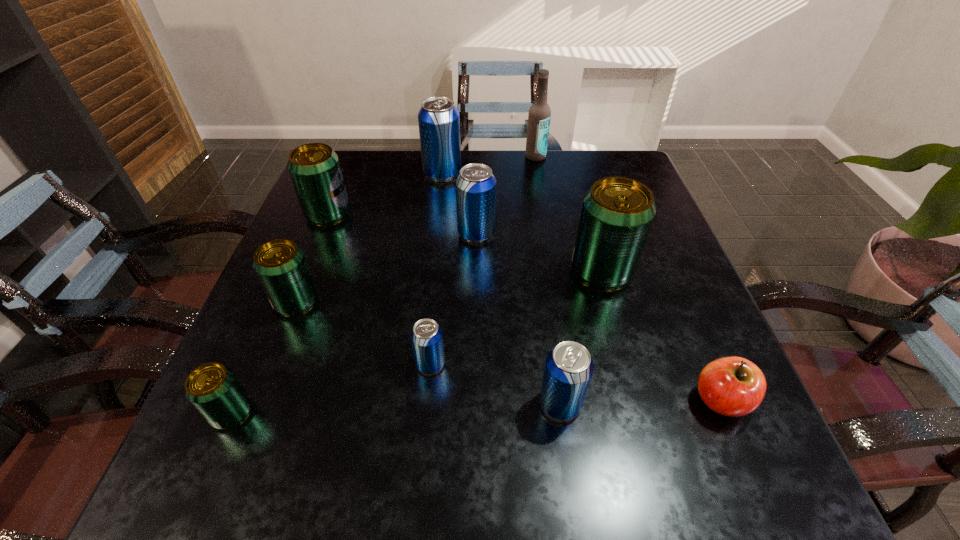
Image resolution: width=960 pixels, height=540 pixels. I want to click on vacant space located on the right of the third biggest green beer can, so click(x=490, y=302).

This screenshot has height=540, width=960. I want to click on free point located on the back of the nearest blue beer can, so click(543, 283).

This screenshot has width=960, height=540. I want to click on vacant space located on the left of the third nearest beer can, so click(387, 363).

Locate an element on the screen. vacant space located 0.310m on the right of the smallest green beer can is located at coordinates (445, 413).

Image resolution: width=960 pixels, height=540 pixels. Identify the location of free space located 0.390m on the back of the rightmost object. (649, 232).

At what (x,y) coordinates should I click in order to perform the action: click on beer bottle that is at the far edge. Please return your answer as a coordinate pair (x, y). Looking at the image, I should click on (539, 116).

The height and width of the screenshot is (540, 960). I want to click on beer can present at the far edge, so click(438, 119).

You are a GUI agent. You are given a task and a screenshot of the screen. Output one action in this format:
    pyautogui.click(x=<x>, y=<y>)
    Task: Click on the beer can present at the right edge
    This screenshot has height=540, width=960.
    Given the screenshot: What is the action you would take?
    pyautogui.click(x=617, y=213)

This screenshot has width=960, height=540. Identify the location of apple situated at the right edge. (733, 386).

Locate an element on the screen. This screenshot has width=960, height=540. vacant region at the far edge of the desktop is located at coordinates (x=417, y=157).